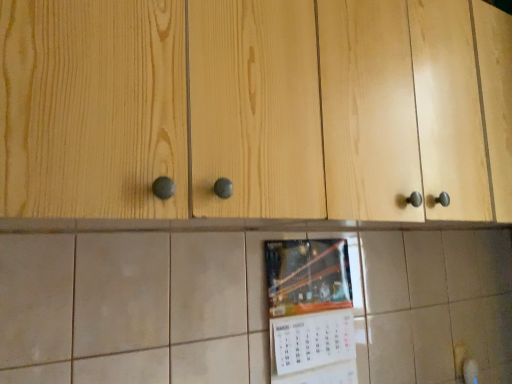
The width and height of the screenshot is (512, 384). What are the coordinates of `natural wood cabinet at upper center` in the screenshot? It's located at (168, 109).

This screenshot has height=384, width=512. What do you see at coordinates (168, 109) in the screenshot?
I see `natural wood cabinet at upper center` at bounding box center [168, 109].

What are the coordinates of `natural wood cabinet at upper center` in the screenshot? It's located at (168, 109).